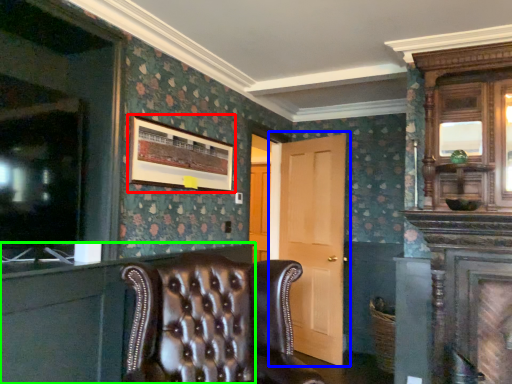
Question: Which object is positioned farthest from picture frame (highlighted by a red box)? Select from door (highlighted by a blue box) and dresser (highlighted by a green box).

Choices:
 (A) door
 (B) dresser

Answer: (A)